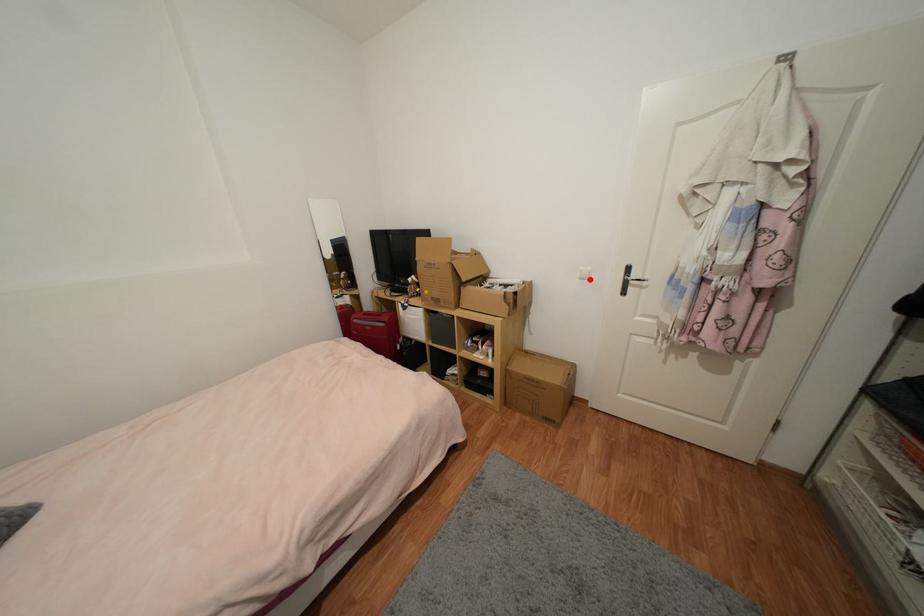
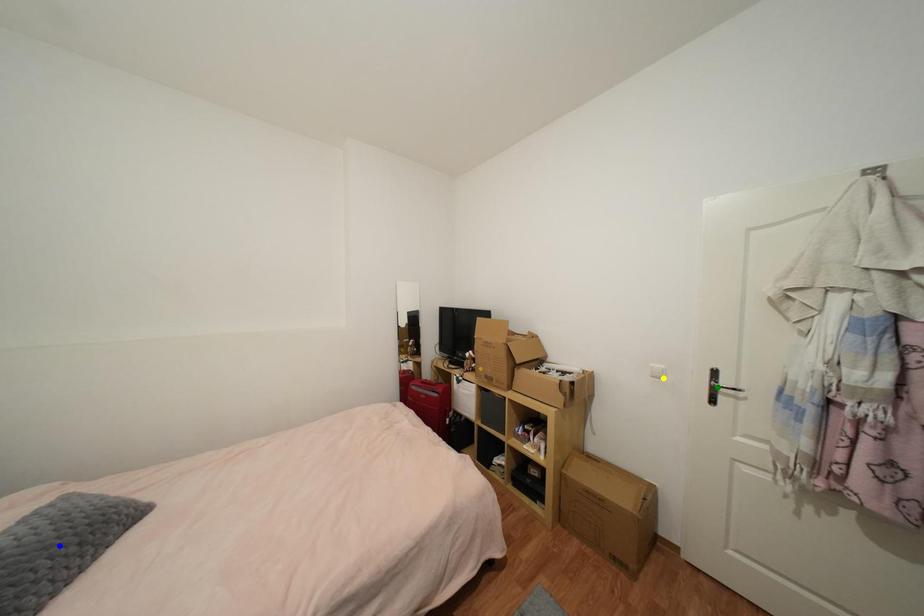
Question: I am providing you with two images of the same scene from different viewpoints. A red point is marked on the first image. You are given multiple points on the second image. Can you choose the point in image 2 that corresponds to the point in image 1?

Choices:
 (A) blue point
 (B) green point
 (C) yellow point

Answer: (C)